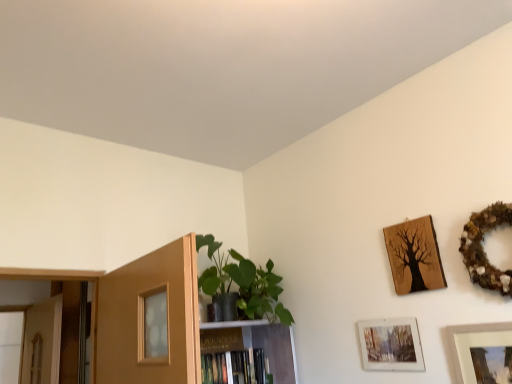
Question: Considering the positions of point (387, 332) and point (501, 203), is point (387, 332) closer or farther from the camera than point (501, 203)?

Choices:
 (A) farther
 (B) closer

Answer: (A)

Question: Looking at their shapes, would you say matte glass picture frame at lower right, the 3th picture frame positioned from the top, is wider or thinner than wooden wreath at upper right, acting as the 4th picture frame starting from the bottom?

Choices:
 (A) thin
 (B) wide

Answer: (A)

Question: Estimate the real-world distances between objects in this image. Which object is closer to the wooden wreath at upper right, acting as the 4th picture frame starting from the bottom?

Choices:
 (A) matte glass picture frame at lower right, which is the 2th picture frame in bottom-to-top order
 (B) wooden tree art at upper right, placed as the second picture frame when sorted from top to bottom
 (C) wooden picture frame at upper right, the 1th picture frame positioned from the bottom
 (D) hardcover book at center
 (E) green matte plant at center

Answer: (B)

Question: Which of these objects is positioned farthest from the green matte plant at center?

Choices:
 (A) wooden picture frame at upper right, the 1th picture frame positioned from the bottom
 (B) matte glass picture frame at lower right, the 3th picture frame positioned from the top
 (C) wooden wreath at upper right, acting as the 4th picture frame starting from the bottom
 (D) wooden tree art at upper right, placed as the second picture frame when sorted from top to bottom
 (E) hardcover book at center

Answer: (C)